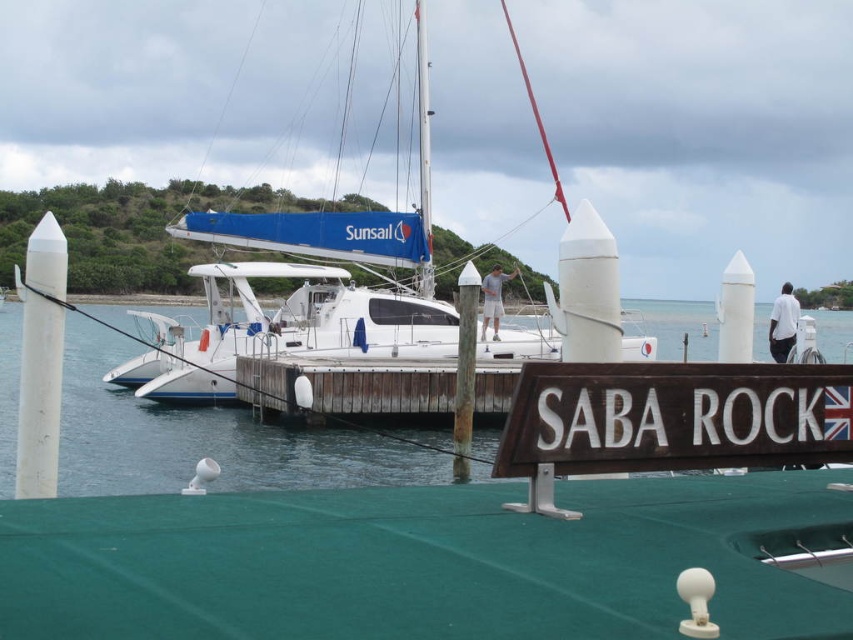
Is white glossy catamaran at center thinner than brown wooden dock at center?

No.

Between point (155, 401) and point (524, 362), which one is positioned behind?

Point (155, 401)

What are the coordinates of `white glossy catamaran at center` in the screenshot? It's located at (306, 289).

Who is lower down, brown wooden sign at lower center or brown wooden dock at center?

brown wooden dock at center is below.

Does brown wooden sign at lower center appear over brown wooden dock at center?

Yes, brown wooden sign at lower center is above brown wooden dock at center.

Is point (839, 433) closer to viewer compared to point (276, 396)?

Yes, point (839, 433) is closer to viewer.

Find the location of a particular element. The image size is (853, 640). brown wooden sign at lower center is located at coordinates (674, 417).

Find the location of `clear blue water at center`. clear blue water at center is located at coordinates (202, 438).

Does clear blue water at center appear over brown wooden sign at lower center?

Yes.

Describe the element at coordinates (202, 438) in the screenshot. This screenshot has height=640, width=853. I see `clear blue water at center` at that location.

I want to click on clear blue water at center, so click(x=202, y=438).